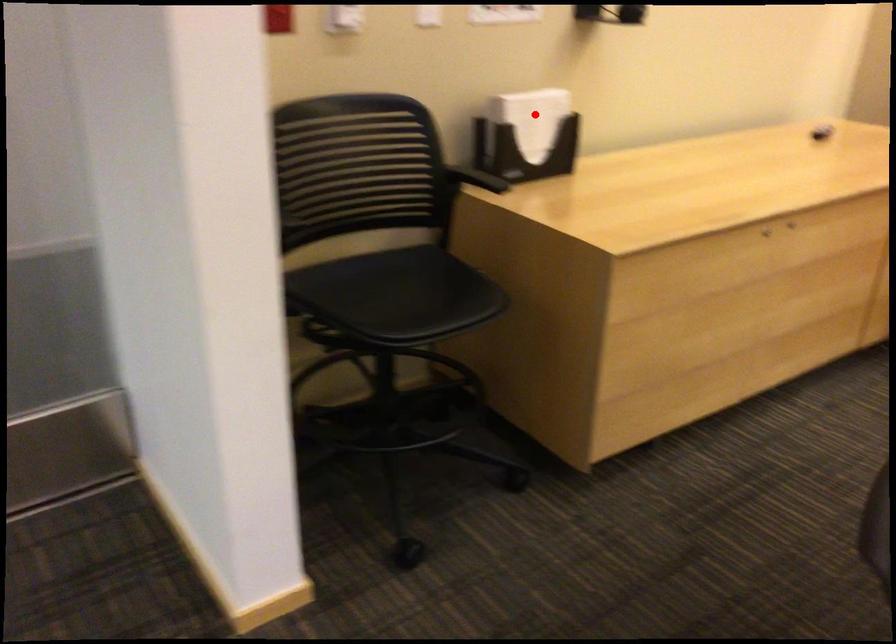
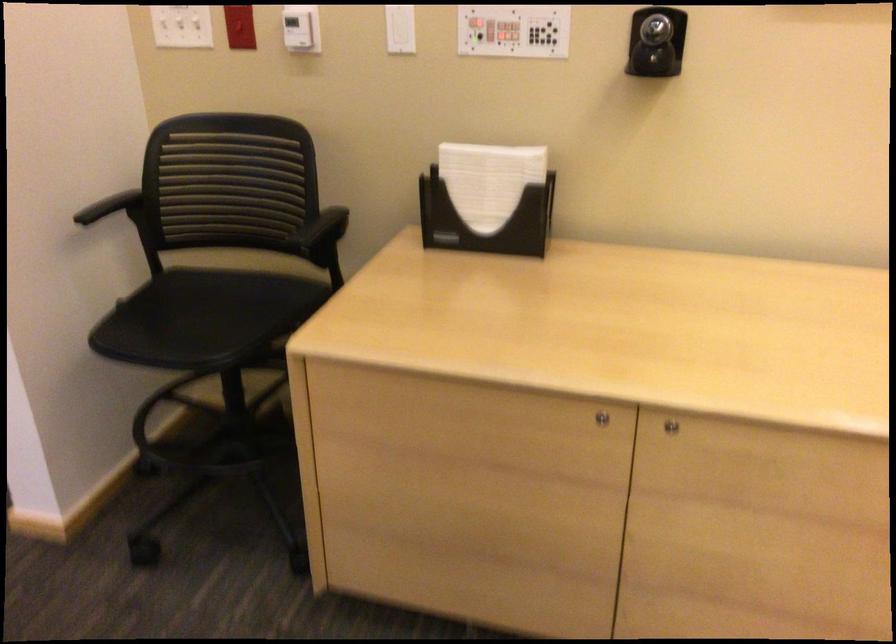
Question: I am providing you with two images of the same scene from different viewpoints. Image1 has a red point marked. In image2, the corresponding 3D location appears at what relative position? Reply with the corresponding letter.

Choices:
 (A) Closer
 (B) Farther

Answer: (A)